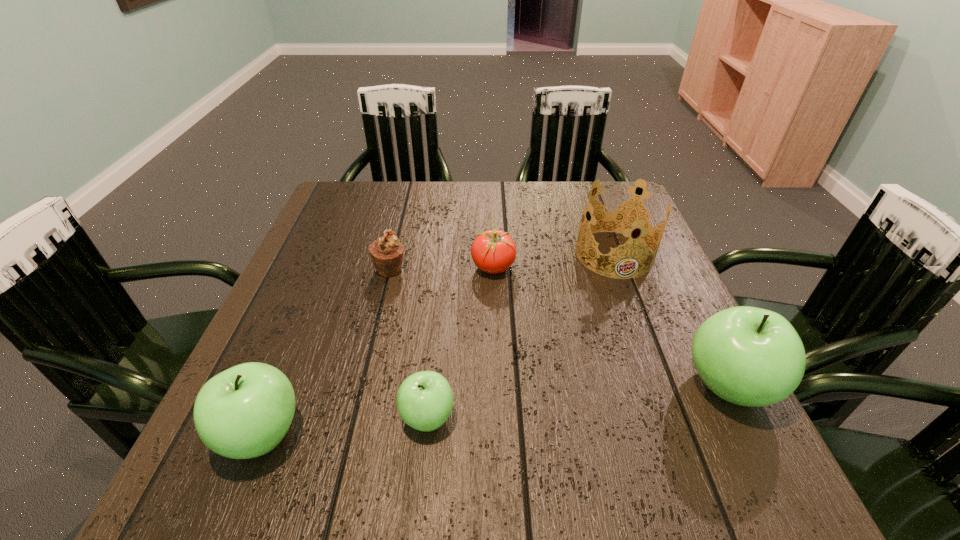
What are the coordinates of `free space between the tomato and the rightmost apple` in the screenshot? It's located at (611, 327).

This screenshot has width=960, height=540. In order to click on free spot between the leftmost apple and the crown in this screenshot , I will do `click(439, 344)`.

The height and width of the screenshot is (540, 960). In order to click on vacant area that lies between the rightmost apple and the fourth object from right to left in this screenshot , I will do point(578,402).

Locate which object is the fifth closest to the tomato. Please provide its 2D coordinates. Your answer should be formatted as a tuple, i.e. [(x, y)], where the tuple contains the x and y coordinates of a point satisfying the conditions above.

[(244, 412)]

This screenshot has width=960, height=540. I want to click on object that is the fifth closest one to the tomato, so click(244, 412).

At what (x,y) coordinates should I click in order to perform the action: click on apple that is the third closest one to the third object from right to left. Please return your answer as a coordinate pair (x, y). The width and height of the screenshot is (960, 540). Looking at the image, I should click on (244, 412).

Identify which apple is the closest to the crown. Please provide its 2D coordinates. Your answer should be formatted as a tuple, i.e. [(x, y)], where the tuple contains the x and y coordinates of a point satisfying the conditions above.

[(749, 356)]

Find the location of `free point that satisfies the following two spatial constraints: 1. on the front side of the crown; 2. on the left side of the rightmost apple`. free point that satisfies the following two spatial constraints: 1. on the front side of the crown; 2. on the left side of the rightmost apple is located at coordinates (663, 386).

The height and width of the screenshot is (540, 960). I want to click on vacant area that satisfies the following two spatial constraints: 1. on the front side of the tomato; 2. on the left side of the rightmost apple, so click(x=497, y=386).

Locate an element on the screen. free location that satisfies the following two spatial constraints: 1. on the back side of the crown; 2. on the left side of the fifth object from right to left is located at coordinates (394, 254).